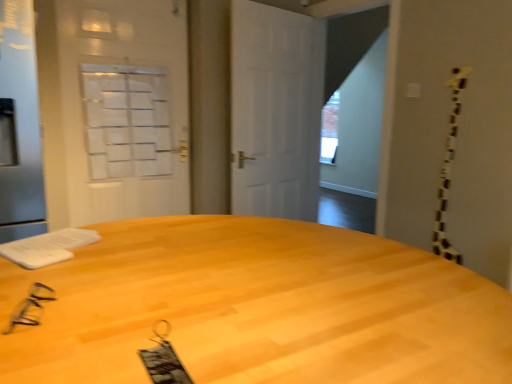
The height and width of the screenshot is (384, 512). What do you see at coordinates (257, 307) in the screenshot?
I see `light wood desk at center` at bounding box center [257, 307].

Identify the location of white matte door at center. (275, 111).

Describe the element at coordinates (31, 307) in the screenshot. This screenshot has height=384, width=512. I see `black plastic glasses at lower left` at that location.

Identify the location of light wood desk at center. Image resolution: width=512 pixels, height=384 pixels. (257, 307).

In terms of height, does silver metallic screen door at left, which is the 1th screen door in front-to-back order, look taller or shorter compared to light wood desk at center?

In the image, silver metallic screen door at left, which is the 1th screen door in front-to-back order, appears to be taller than light wood desk at center.

Is silver metallic screen door at left, which is the second screen door in back-to-front order, further to camera compared to light wood desk at center?

Yes, silver metallic screen door at left, which is the second screen door in back-to-front order, is further from the camera.

From the picture: From a real-world perspective, is silver metallic screen door at left, which is the second screen door in back-to-front order, positioned under light wood desk at center based on gravity?

Actually, silver metallic screen door at left, which is the second screen door in back-to-front order, is physically above light wood desk at center in the real world.

What's the angular difference between silver metallic screen door at left, which is the 1th screen door in front-to-back order, and light wood desk at center's facing directions?

The angle between the facing direction of silver metallic screen door at left, which is the 1th screen door in front-to-back order, and the facing direction of light wood desk at center is 91.4 degrees.

Can you confirm if silver metallic screen door at left, which is the 1th screen door in front-to-back order, is smaller than white matte door at center?

Actually, silver metallic screen door at left, which is the 1th screen door in front-to-back order, might be larger than white matte door at center.

Does silver metallic screen door at left, which is the second screen door in back-to-front order, have a lesser width compared to white matte door at center?

No, silver metallic screen door at left, which is the second screen door in back-to-front order, is not thinner than white matte door at center.

Is silver metallic screen door at left, which is the 1th screen door in front-to-back order, aimed at white matte door at center?

No, silver metallic screen door at left, which is the 1th screen door in front-to-back order, is not turned towards white matte door at center.

Identify the location of the 2nd screen door counting from the left of the white matte door at center. tap(19, 126).

Is white matte door at center placed right next to light wood desk at center?

No, white matte door at center is not in contact with light wood desk at center.

Does point (277, 212) come behind point (197, 355)?

That is True.

Measure the distance between white matte door at center and light wood desk at center.

white matte door at center is 2.05 meters from light wood desk at center.

Which of these two, white matte door at center or light wood desk at center, is bigger?

Bigger between the two is light wood desk at center.

Which object is closer to the camera taking this photo, white frosted glass screen door at upper left, which ranks as the 1th screen door in back-to-front order, or silver metallic screen door at left, which is the 1th screen door in front-to-back order?

Positioned in front is silver metallic screen door at left, which is the 1th screen door in front-to-back order.

Is white frosted glass screen door at upper left, the 2th screen door positioned from the front, spatially inside silver metallic screen door at left, which is the 1th screen door in front-to-back order, or outside of it?

white frosted glass screen door at upper left, the 2th screen door positioned from the front, exists outside the volume of silver metallic screen door at left, which is the 1th screen door in front-to-back order.

Is white frosted glass screen door at upper left, the 2th screen door positioned from the front, turned away from silver metallic screen door at left, which is the 1th screen door in front-to-back order?

No.

Considering the relative sizes of white frosted glass screen door at upper left, the 2th screen door positioned from the front, and silver metallic screen door at left, which is the second screen door in back-to-front order, in the image provided, is white frosted glass screen door at upper left, the 2th screen door positioned from the front, wider than silver metallic screen door at left, which is the second screen door in back-to-front order,?

No.

Looking at the image, does black plastic glasses at lower left seem bigger or smaller compared to white matte door at center?

In the image, black plastic glasses at lower left appears to be smaller than white matte door at center.

This screenshot has height=384, width=512. Find the location of `door that appears on the right of black plastic glasses at lower left`. door that appears on the right of black plastic glasses at lower left is located at coordinates (275, 111).

From the image's perspective, is black plastic glasses at lower left above or below white matte door at center?

Based on their image positions, black plastic glasses at lower left is located beneath white matte door at center.

From a real-world perspective, is black plastic glasses at lower left located beneath white matte door at center?

Yes, from a real-world perspective, black plastic glasses at lower left is below white matte door at center.

From a real-world perspective, is light wood desk at center below white frosted glass screen door at upper left, the 2th screen door positioned from the front?

Indeed, from a real-world perspective, light wood desk at center is positioned beneath white frosted glass screen door at upper left, the 2th screen door positioned from the front.

Is white frosted glass screen door at upper left, the 2th screen door positioned from the front, surrounded by light wood desk at center?

No, white frosted glass screen door at upper left, the 2th screen door positioned from the front, is located outside of light wood desk at center.

Does light wood desk at center lie in front of white frosted glass screen door at upper left, the 2th screen door positioned from the front?

Yes, light wood desk at center is closer to the viewer.

Which object is positioned more to the left, light wood desk at center or white frosted glass screen door at upper left, the 2th screen door positioned from the front?

white frosted glass screen door at upper left, the 2th screen door positioned from the front, is more to the left.

Considering the points (268, 223) and (30, 66), which point is in front, point (268, 223) or point (30, 66)?

The point (268, 223) is closer.

Looking at this image, is light wood desk at center facing away from silver metallic screen door at left, which is the 1th screen door in front-to-back order?

No, silver metallic screen door at left, which is the 1th screen door in front-to-back order, is not at the back of light wood desk at center.

Based on their sizes in the image, would you say light wood desk at center is bigger or smaller than silver metallic screen door at left, which is the 1th screen door in front-to-back order?

Answer: In the image, light wood desk at center appears to be larger than silver metallic screen door at left, which is the 1th screen door in front-to-back order.

Is light wood desk at center beside silver metallic screen door at left, which is the 1th screen door in front-to-back order?

No, light wood desk at center is not in contact with silver metallic screen door at left, which is the 1th screen door in front-to-back order.

I want to click on desk on the right of silver metallic screen door at left, which is the 1th screen door in front-to-back order, so [257, 307].

What are the coordinates of `door below the silver metallic screen door at left, which is the 1th screen door in front-to-back order (from a real-world perspective)` in the screenshot? It's located at (275, 111).

Based on their spatial positions, is silver metallic screen door at left, which is the second screen door in back-to-front order, or white matte door at center further from white frosted glass screen door at upper left, the 2th screen door positioned from the front?

silver metallic screen door at left, which is the second screen door in back-to-front order.

Considering their positions, is silver metallic screen door at left, which is the 1th screen door in front-to-back order, positioned closer to light wood desk at center than white frosted glass screen door at upper left, which ranks as the 1th screen door in back-to-front order?

silver metallic screen door at left, which is the 1th screen door in front-to-back order, lies closer to light wood desk at center than the other object.

Based on their spatial positions, is black plastic glasses at lower left or silver metallic screen door at left, which is the second screen door in back-to-front order, further from white matte door at center?

Among the two, black plastic glasses at lower left is located further to white matte door at center.

Considering their positions, is silver metallic screen door at left, which is the 1th screen door in front-to-back order, positioned further to light wood desk at center than white matte door at center?

white matte door at center is further to light wood desk at center.

In the scene shown: Considering their positions, is white frosted glass screen door at upper left, which ranks as the 1th screen door in back-to-front order, positioned further to white matte door at center than silver metallic screen door at left, which is the second screen door in back-to-front order?

silver metallic screen door at left, which is the second screen door in back-to-front order.

Looking at the image, which one is located closer to black plastic glasses at lower left, white matte door at center or light wood desk at center?

light wood desk at center is closer to black plastic glasses at lower left.

When comparing their distances from light wood desk at center, does black plastic glasses at lower left or white frosted glass screen door at upper left, the 2th screen door positioned from the front, seem further?

white frosted glass screen door at upper left, the 2th screen door positioned from the front, lies further to light wood desk at center than the other object.

Considering their positions, is light wood desk at center positioned closer to white frosted glass screen door at upper left, the 2th screen door positioned from the front, than silver metallic screen door at left, which is the second screen door in back-to-front order?

silver metallic screen door at left, which is the second screen door in back-to-front order, is closer to white frosted glass screen door at upper left, the 2th screen door positioned from the front.

At what (x,y) coordinates should I click in order to perform the action: click on screen door located between light wood desk at center and white frosted glass screen door at upper left, which ranks as the 1th screen door in back-to-front order, in the depth direction. Please return your answer as a coordinate pair (x, y). Looking at the image, I should click on (19, 126).

Identify the location of glasses between light wood desk at center and white frosted glass screen door at upper left, the 2th screen door positioned from the front, in the front-back direction. click(31, 307).

Locate an element on the screen. This screenshot has width=512, height=384. screen door situated between silver metallic screen door at left, which is the 1th screen door in front-to-back order, and white matte door at center from left to right is located at coordinates (114, 109).

At what (x,y) coordinates should I click in order to perform the action: click on glasses between light wood desk at center and white matte door at center along the z-axis. Please return your answer as a coordinate pair (x, y). This screenshot has width=512, height=384. Looking at the image, I should click on (31, 307).